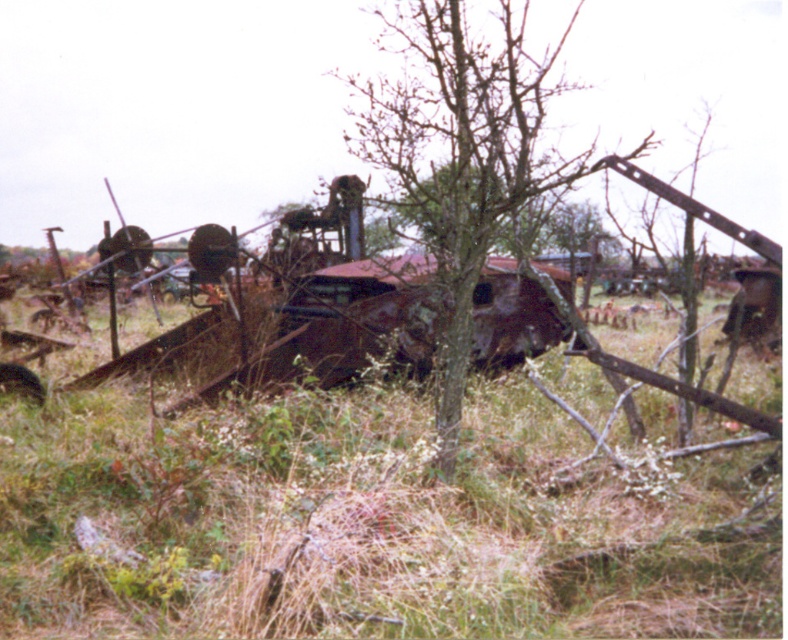
Question: Which of the following is the closest to the observer?

Choices:
 (A) (487, 58)
 (B) (102, 570)

Answer: (B)

Question: Does green grass at center come behind bare wood tree at center?

Choices:
 (A) yes
 (B) no

Answer: (B)

Question: Which object appears closest to the camera in this image?

Choices:
 (A) bare wood tree at center
 (B) rusty metal train car at center

Answer: (A)

Question: Does bare wood tree at center come behind rusty metal train car at center?

Choices:
 (A) yes
 (B) no

Answer: (B)

Question: Which point appears closest to the camera in this image?

Choices:
 (A) (370, 346)
 (B) (426, 584)

Answer: (B)

Question: Can you confirm if bare wood tree at center is positioned to the right of rusty metal train car at center?

Choices:
 (A) yes
 (B) no

Answer: (A)